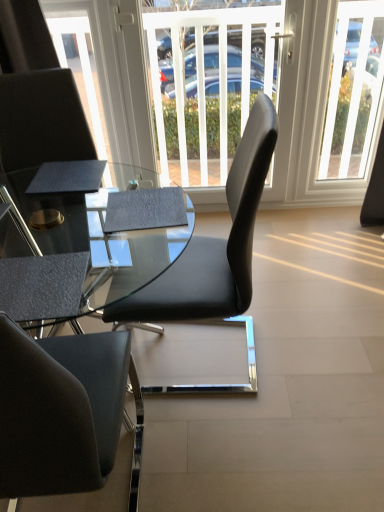
Identify the location of vacant area to the right of white matte door at center. This screenshot has height=512, width=384. (313, 228).